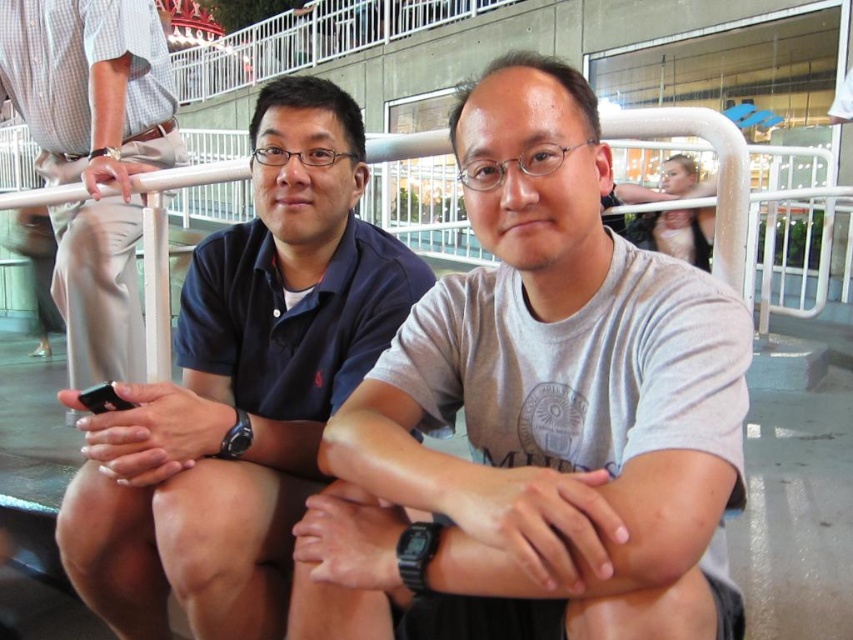
You are a photographer standing in front of the two people in the image. You want to take a photo that clearly shows both the dark blue shirt at left and the light brown fabric pants at left. Which object should you focus on first to ensure both are in sharp focus?

You should focus on the dark blue shirt at left first because it is closer to the viewer than the light brown fabric pants at left. By focusing on the closer object, the depth of field may extend to include the pants in focus as well.

You are a photographer at the scene. You want to capture a photo that includes both the dark blue shirt at left and the white metal rail at upper center. Based on their sizes, which object should you focus on to ensure both fit in the frame?

Since the dark blue shirt at left is wider than the white metal rail at upper center, you should focus on the dark blue shirt at left to ensure both fit in the frame as it occupies more space.

You are a photographer trying to capture a photo of both the dark blue shirt at left and the light brown fabric pants at left. Since you want to ensure both are clearly visible, which object should you focus on first considering their sizes?

The dark blue shirt at left is smaller than the light brown fabric pants at left, so you should focus on the dark blue shirt at left first to ensure it is clearly visible.